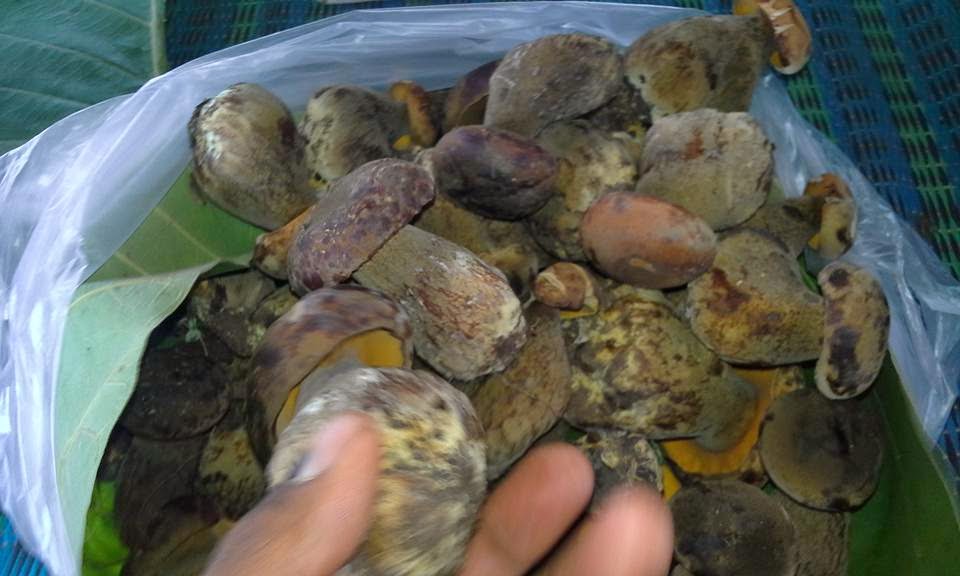
Find the location of a particular element. fabric edge is located at coordinates (159, 28).